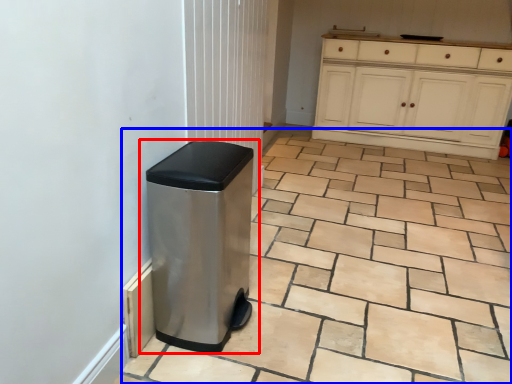
Question: Which object is further to the camera taking this photo, waste container (highlighted by a red box) or ceramic tile (highlighted by a blue box)?

Choices:
 (A) waste container
 (B) ceramic tile

Answer: (A)